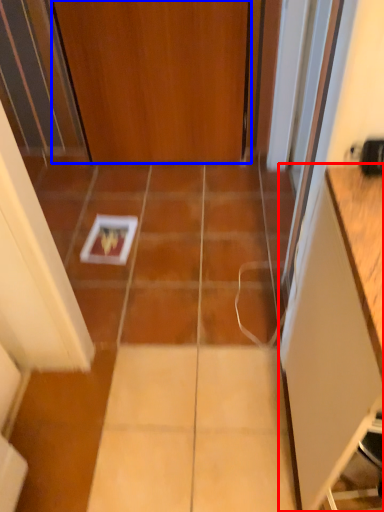
Question: Which point is further to the camera, cabinetry (highlighted by a red box) or door (highlighted by a blue box)?

Choices:
 (A) cabinetry
 (B) door

Answer: (B)